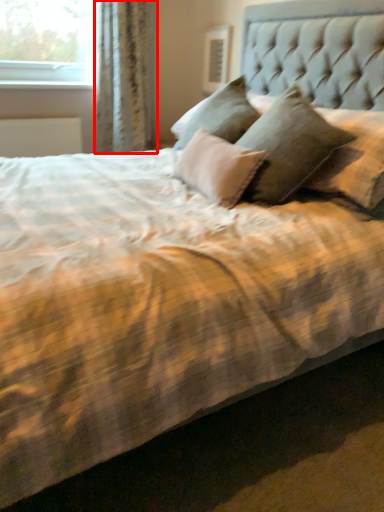
Question: From the image's perspective, considering the relative positions of curtain (annotated by the red box) and window sill in the image provided, where is curtain (annotated by the red box) located with respect to the staircase?

Choices:
 (A) below
 (B) above

Answer: (A)